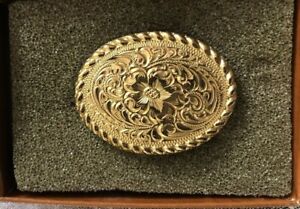
Find the location of a particular element. wooden box is located at coordinates (167, 202), (100, 200), (70, 197).